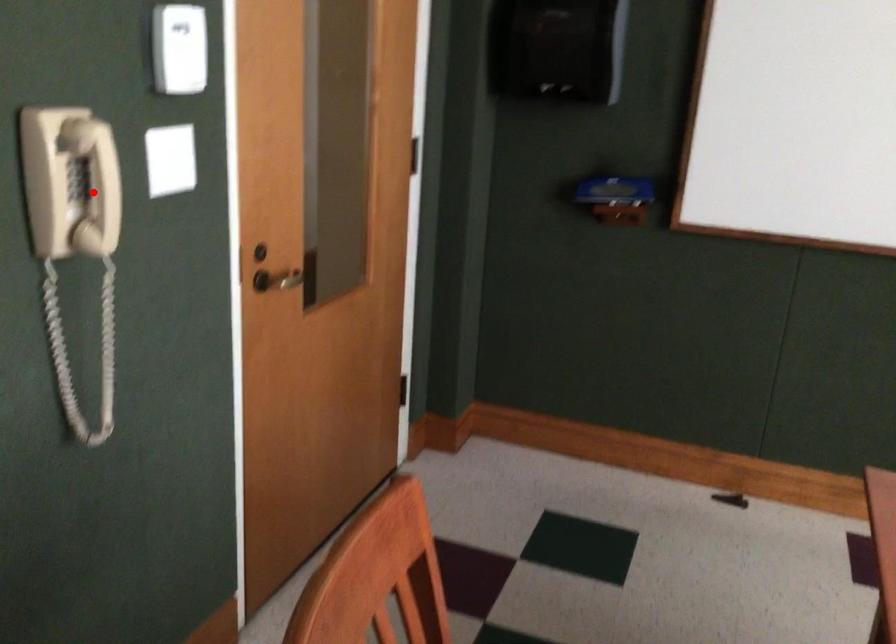
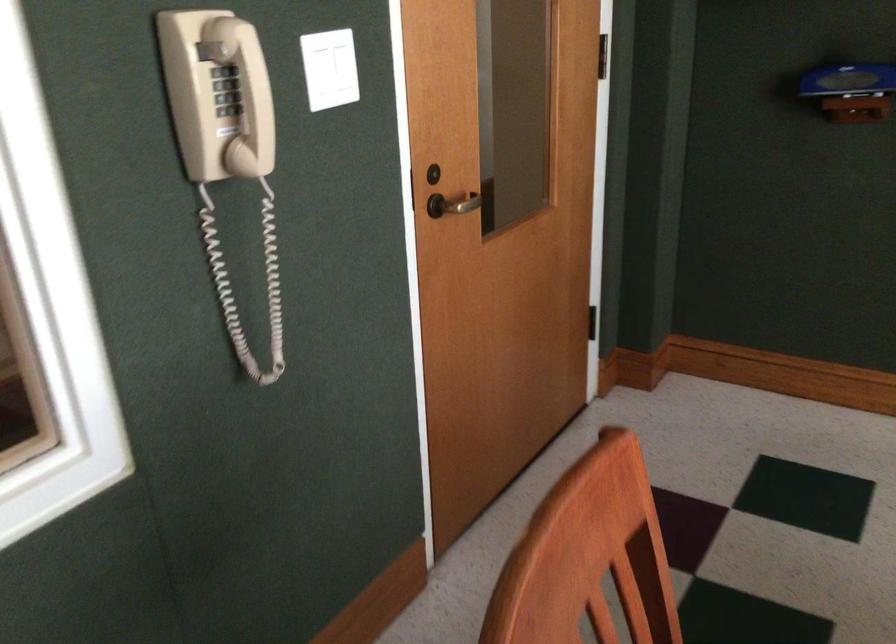
Question: A red point is marked in image1. In image2, is the corresponding 3D point closer to the camera or farther? Reply with the corresponding letter.

Choices:
 (A) The corresponding 3D point is closer.
 (B) The corresponding 3D point is farther.

Answer: (A)